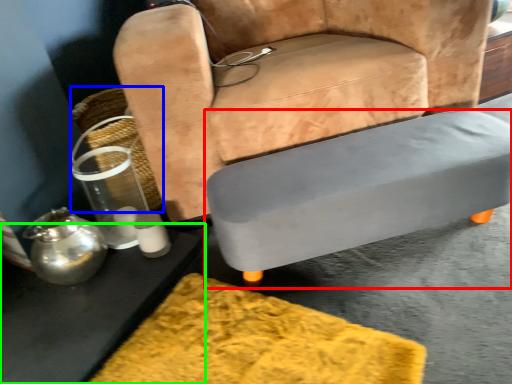
Question: Which is farther away from table (highlighted by a red box)? basket (highlighted by a blue box) or table (highlighted by a green box)?

Choices:
 (A) basket
 (B) table

Answer: (A)